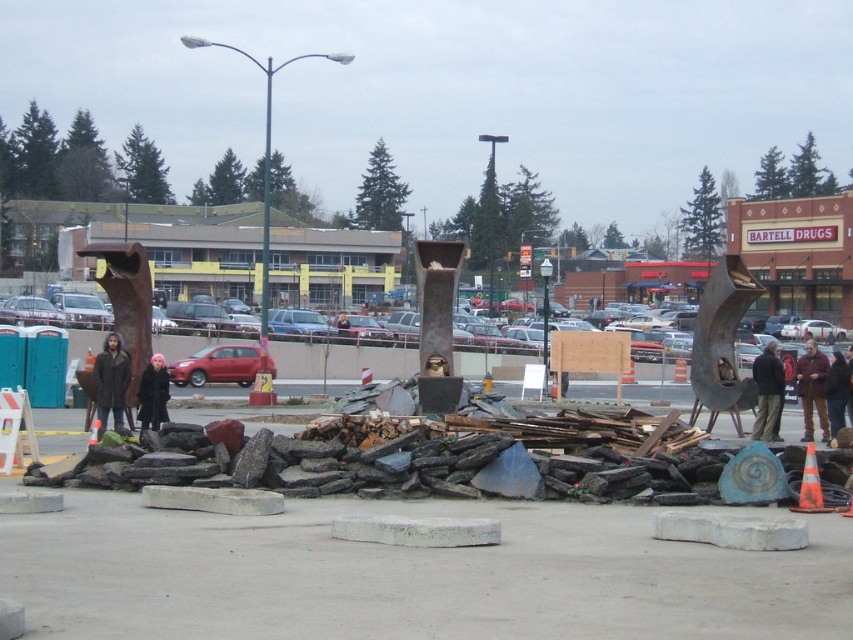
Between point (386, 353) and point (804, 481), which one is positioned in front?

Point (804, 481) is in front.

Between rusty metal parking lot at center and orange reflective cone at center, which one has less height?

Standing shorter between the two is orange reflective cone at center.

Between point (520, 348) and point (802, 509), which one is positioned behind?

Positioned behind is point (520, 348).

Locate an element on the screen. The height and width of the screenshot is (640, 853). rusty metal parking lot at center is located at coordinates (339, 356).

Does dark brown coat at left have a larger size compared to orange reflective cone at center?

Yes.

Who is higher up, dark brown coat at left or orange reflective cone at center?

dark brown coat at left is above.

What do you see at coordinates (111, 381) in the screenshot?
I see `dark brown coat at left` at bounding box center [111, 381].

Find the location of a particular element. dark brown coat at left is located at coordinates (111, 381).

Between dark brown coat at left and dark brown leather jacket at lower right, which one is positioned lower?

dark brown coat at left is lower down.

Between point (100, 388) and point (779, 362), which one is positioned behind?

Positioned behind is point (779, 362).

Find the location of a particular element. The height and width of the screenshot is (640, 853). dark brown coat at left is located at coordinates (111, 381).